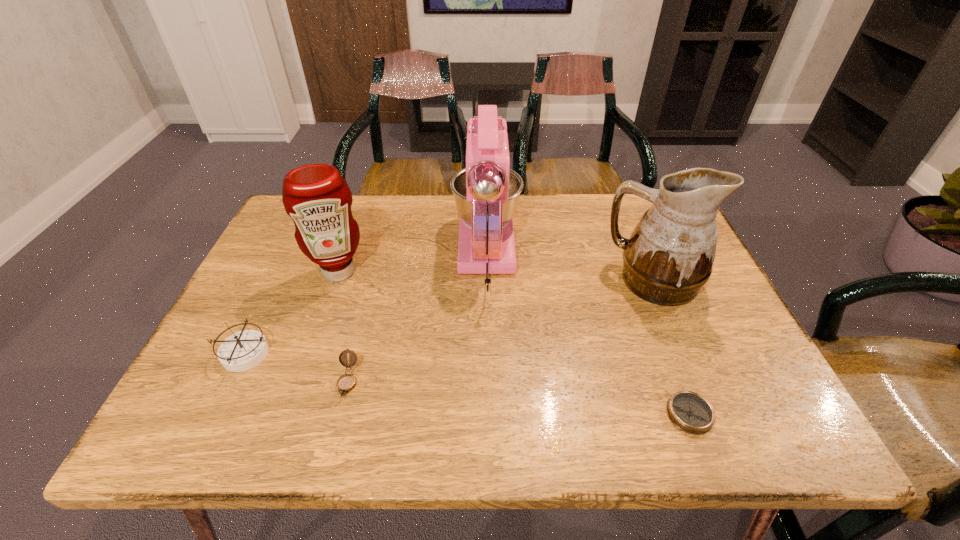
Where is `compass that is at the left edge`? compass that is at the left edge is located at coordinates (243, 350).

Where is `pitcher present at the right edge`? The width and height of the screenshot is (960, 540). pitcher present at the right edge is located at coordinates (669, 256).

You are a GUI agent. You are given a task and a screenshot of the screen. Output one action in this format:
    pyautogui.click(x=<x>, y=<y>)
    Task: Click on the compass present at the right edge
    This screenshot has height=540, width=960.
    Given the screenshot: What is the action you would take?
    pyautogui.click(x=690, y=412)

Find the location of a particular element. This screenshot has width=960, height=540. object at the near right corner is located at coordinates (690, 412).

Find the location of a particular element. The width and height of the screenshot is (960, 540). vacant space at the far edge of the desktop is located at coordinates (601, 222).

The width and height of the screenshot is (960, 540). Identify the location of free space at the near edge of the desktop. (532, 417).

At what (x,y) coordinates should I click in order to perform the action: click on free space at the left edge of the desktop. Please return your answer as a coordinate pair (x, y). Looking at the image, I should click on (291, 268).

The width and height of the screenshot is (960, 540). Identify the location of free space at the right edge of the desktop. click(x=717, y=308).

The height and width of the screenshot is (540, 960). In order to click on vacant space at the near right corner of the desktop in this screenshot , I will do `click(790, 427)`.

Image resolution: width=960 pixels, height=540 pixels. What are the coordinates of `free space between the shortest compass and the fourth object from left to right` in the screenshot? It's located at (588, 334).